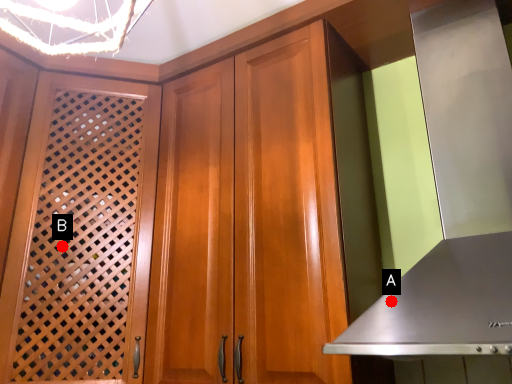
Question: Two points are circled on the image, labeled by A and B beside each circle. Which point appears farthest from the camera in this image?

Choices:
 (A) A is further
 (B) B is further

Answer: (B)